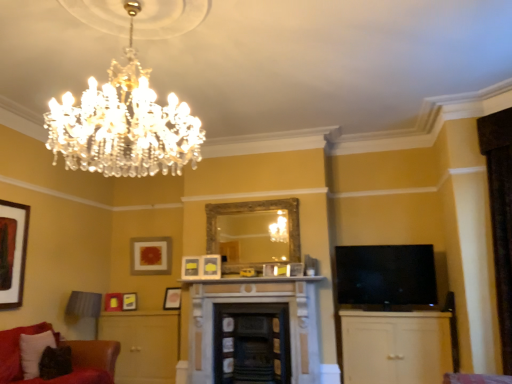
Question: Looking at the image, does white marble fireplace at center seem bigger or smaller compared to black glossy tv at right?

Choices:
 (A) big
 (B) small

Answer: (B)

Question: Is white marble fireplace at center in front of or behind black glossy tv at right in the image?

Choices:
 (A) behind
 (B) front

Answer: (A)

Question: Which object is the farthest from the matte gold picture frame at center, which is the fifth picture frame in left-to-right order?

Choices:
 (A) matte wood dresser at lower left
 (B) smooth black fireplace at center, positioned as the first fireplace in right-to-left order
 (C) white marble fireplace at center
 (D) matte yellow picture frame at lower left, acting as the sixth picture frame starting from the right
 (E) white wood cabinet at lower right

Answer: (E)

Question: Estimate the real-world distances between objects in this image. Which object is closer to the white wood cabinet at lower right?

Choices:
 (A) smooth black fireplace at center, acting as the second fireplace starting from the left
 (B) matte yellow picture frame at center, positioned as the sixth picture frame in left-to-right order
 (C) matte gold picture frame at center, the fourth picture frame from the right
 (D) velvet fabric swivel chair at lower left
 (E) matte wood dresser at lower left

Answer: (A)